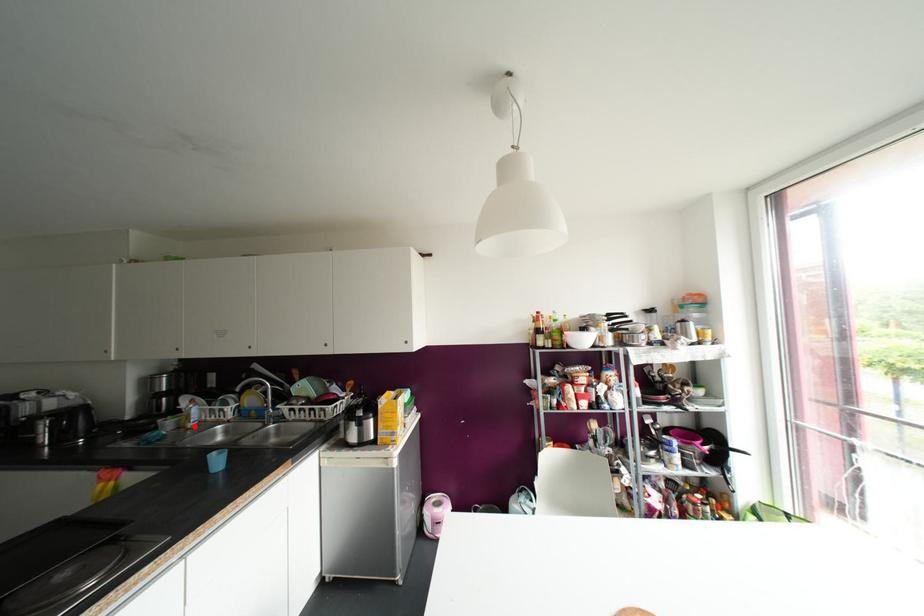
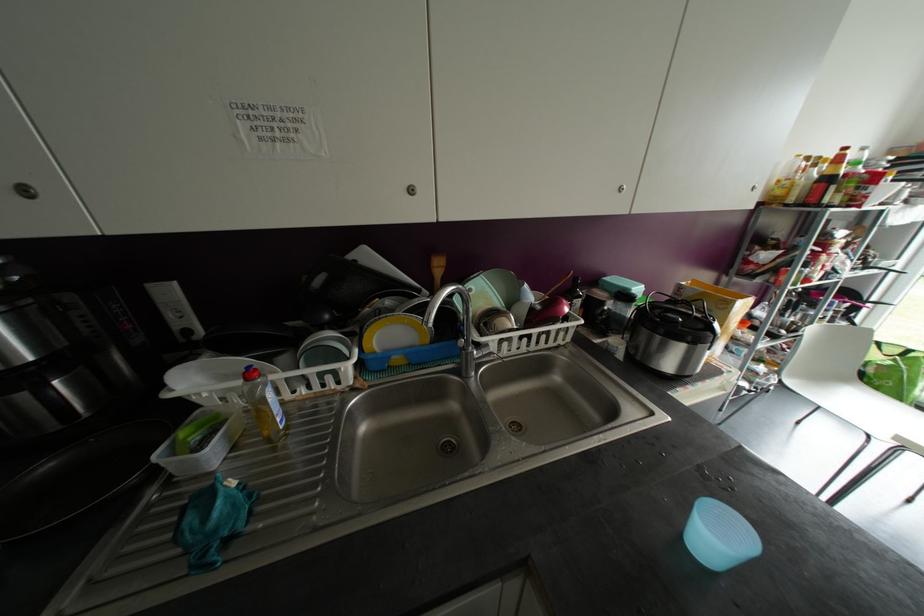
Where in the second image is the point corresponding to the highlighted location from the first image?

(286, 427)